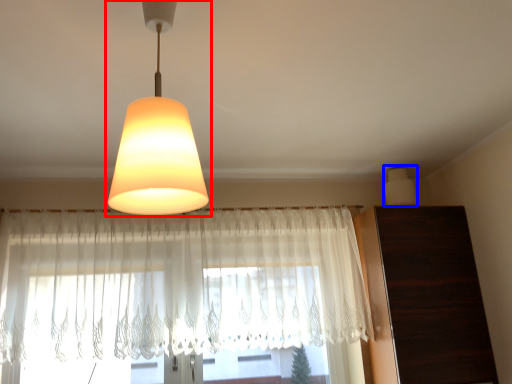
Question: Which object is further to the camera taking this photo, lamp (highlighted by a red box) or lamp (highlighted by a blue box)?

Choices:
 (A) lamp
 (B) lamp

Answer: (B)